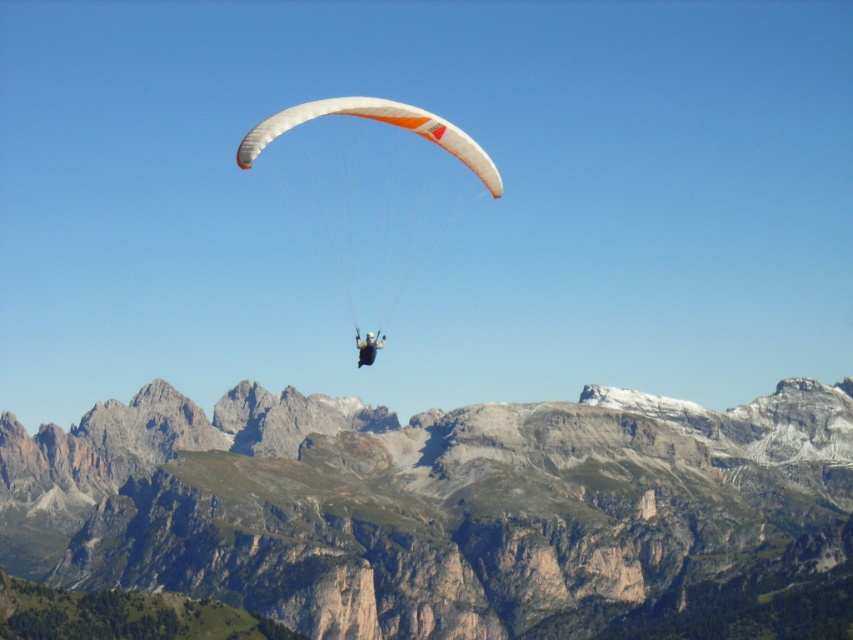
Can you confirm if rugged stone mountain range at center is shorter than white matte parachute at center?

No, rugged stone mountain range at center is not shorter than white matte parachute at center.

From the picture: Between rugged stone mountain range at center and white matte parachute at center, which one has less height?

Standing shorter between the two is white matte parachute at center.

Is point (108, 572) closer to camera compared to point (283, 109)?

Yes.

Where is `rugged stone mountain range at center`? The height and width of the screenshot is (640, 853). rugged stone mountain range at center is located at coordinates (424, 502).

Is rugged stone mountain range at center bigger than matte black paraglider at center?

Indeed, rugged stone mountain range at center has a larger size compared to matte black paraglider at center.

Who is more distant from viewer, (605, 486) or (364, 348)?

The point (605, 486) is behind.

Identify the location of rugged stone mountain range at center. (424, 502).

You are a GUI agent. You are given a task and a screenshot of the screen. Output one action in this format:
    pyautogui.click(x=<x>, y=<y>)
    Task: Click on the rugged stone mountain range at center
    This screenshot has width=853, height=640.
    Given the screenshot: What is the action you would take?
    pyautogui.click(x=424, y=502)

Who is higher up, white matte parachute at center or matte black paraglider at center?

Positioned higher is white matte parachute at center.

Is point (498, 188) closer to viewer compared to point (357, 337)?

No.

At what (x,y) coordinates should I click in order to perform the action: click on white matte parachute at center. Please return your answer as a coordinate pair (x, y). Looking at the image, I should click on (379, 120).